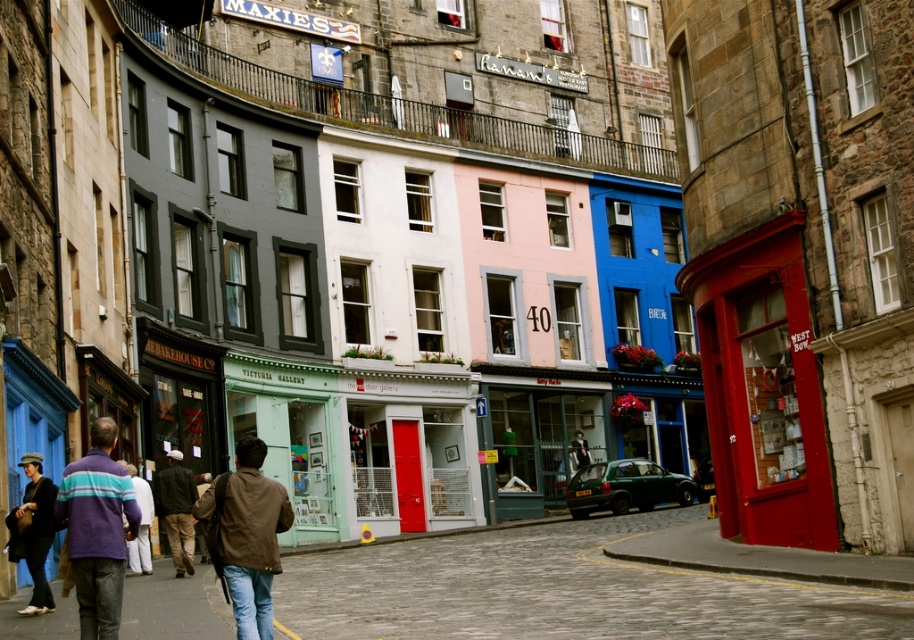
Question: Observing the image, what is the correct spatial positioning of cobblestone pavement at center in reference to striped wool sweater at lower left?

Choices:
 (A) below
 (B) above

Answer: (A)

Question: Which of the following is the farthest from the observer?

Choices:
 (A) (242, 509)
 (B) (179, 472)

Answer: (B)

Question: Does brown leather jacket at center have a greater width compared to brown leather jacket at lower left?

Choices:
 (A) no
 (B) yes

Answer: (A)

Question: Is matte black coat at lower left to the left of brown leather jacket at lower left from the viewer's perspective?

Choices:
 (A) no
 (B) yes

Answer: (A)

Question: Which point appears farthest from the camera in this image?

Choices:
 (A) (416, 596)
 (B) (210, 518)
 (C) (186, 490)
 (D) (89, 579)

Answer: (C)

Question: Which of the following is the farthest from the observer?

Choices:
 (A) (197, 518)
 (B) (43, 480)
 (C) (104, 524)

Answer: (B)